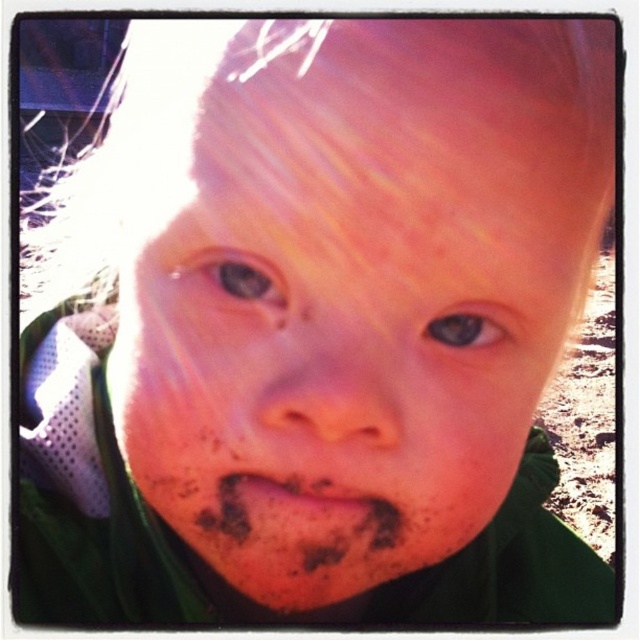
Can you confirm if brown matte eye at upper left is positioned to the left of dusty brown lips at center?

Indeed, brown matte eye at upper left is positioned on the left side of dusty brown lips at center.

Between brown matte eye at upper left and dusty brown lips at center, which one is positioned lower?

dusty brown lips at center is below.

This screenshot has width=640, height=640. Describe the element at coordinates (236, 275) in the screenshot. I see `brown matte eye at upper left` at that location.

This screenshot has width=640, height=640. What are the coordinates of `brown matte eye at upper left` in the screenshot? It's located at (236, 275).

Between brown matte eye at upper left and brown matte eye at center, which one appears on the right side from the viewer's perspective?

Positioned to the right is brown matte eye at center.

Can you confirm if brown matte eye at upper left is positioned below brown matte eye at center?

No, brown matte eye at upper left is not below brown matte eye at center.

Is point (204, 266) in front of point (438, 310)?

No, (204, 266) is behind (438, 310).

Where is `brown matte eye at upper left`? brown matte eye at upper left is located at coordinates (236, 275).

Between dusty brown lips at center and brown matte eye at center, which one has more height?

brown matte eye at center is taller.

Does point (284, 486) come farther from viewer compared to point (452, 339)?

Yes, point (284, 486) is behind point (452, 339).

In order to click on dusty brown lips at center in this screenshot , I will do `click(296, 492)`.